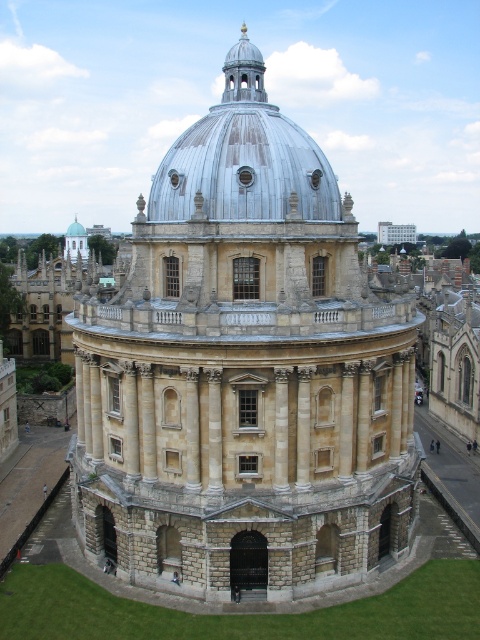
You are an architect reviewing the blueprint of a building. The blueprint shows two domes at the center of the structure. The beige stone dome at center and the metallic silver dome at center. Which one has a larger diameter?

The beige stone dome at center is bigger than the metallic silver dome at center, so the beige stone dome at center has a larger diameter.

You are standing in front of the grand domed building. There are two points marked on the building, one at coordinates point (394,284) and another at point (193,124). Which point is closer to you?

Point (394,284) is further to the viewer than point (193,124). Therefore, point (193,124) is closer to you.